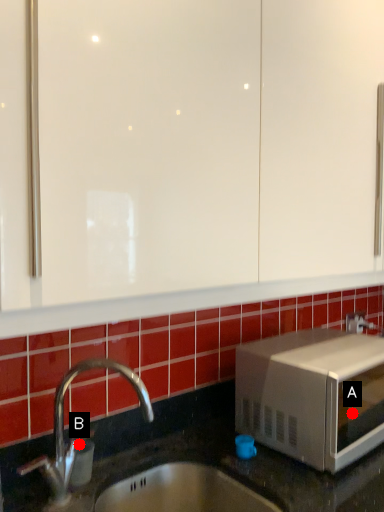
Question: Two points are circled on the image, labeled by A and B beside each circle. Which point is farther to the camera?

Choices:
 (A) A is further
 (B) B is further

Answer: (A)